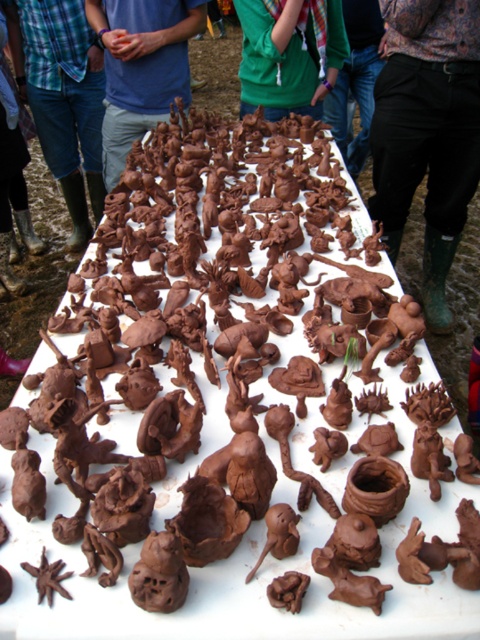
Question: Which of the following is the closest to the observer?

Choices:
 (A) blue matte shirt at upper center
 (B) green matte sweater at center
 (C) green rubber boots at left

Answer: (A)

Question: Does green rubber boots at lower right come in front of green matte shirt at upper center?

Choices:
 (A) no
 (B) yes

Answer: (B)

Question: Does green rubber boots at left appear over green matte sweater at center?

Choices:
 (A) no
 (B) yes

Answer: (A)

Question: Which point is farther from the camera taking this photo?

Choices:
 (A) (359, 100)
 (B) (290, 104)
 (C) (8, 1)

Answer: (A)

Question: Can you confirm if green rubber boots at lower right is bigger than green matte sweater at center?

Choices:
 (A) yes
 (B) no

Answer: (A)

Question: Considering the real-world distances, which object is farthest from the green matte shirt at upper center?

Choices:
 (A) green rubber boots at lower right
 (B) blue matte shirt at upper center

Answer: (B)